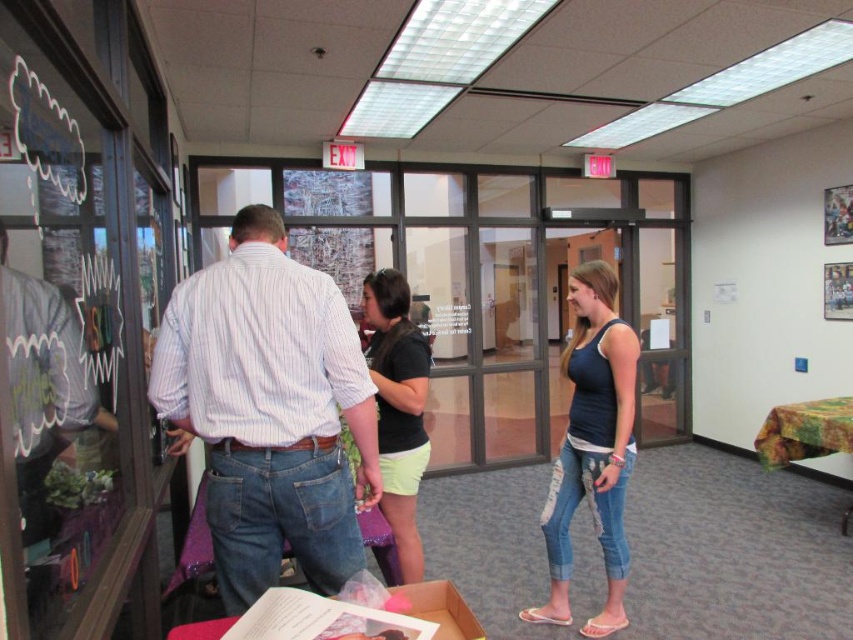
You are a tailor measuring shirts for alterations. You have two shirts in front of you, the striped cotton shirt at center and the brushed metal shirt at left. Which shirt requires a larger amount of fabric for alterations?

The striped cotton shirt at center requires a larger amount of fabric for alterations since it has a larger size compared to the brushed metal shirt at left.

You are organizing a charity event and need to decide which item to place on a narrow shelf that can only hold items up to 10 cm in thickness. Which item between the brushed metal shirt at left and the cardboard box at center would you choose?

The brushed metal shirt at left is thinner than the cardboard box at center, so it would fit on the narrow shelf that can only hold items up to 10 cm in thickness.

You are a fashion designer observing the scene. You see the denim patchwork jeans at center and the black matte shirt at center. Which clothing item is longer in height?

The denim patchwork jeans at center is taller than the black matte shirt at center.